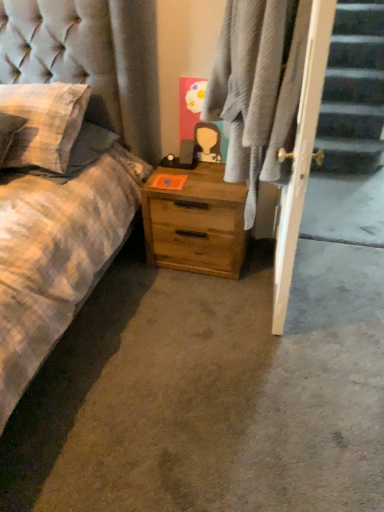
This screenshot has width=384, height=512. What do you see at coordinates (196, 222) in the screenshot?
I see `wooden nightstand at center` at bounding box center [196, 222].

What do you see at coordinates (80, 152) in the screenshot? This screenshot has height=512, width=384. I see `checkered fabric pillow at left` at bounding box center [80, 152].

In order to face checkered fabric pillow at left, should I rotate leftwards or rightwards?

Rotate your view left by about 19.138°.

Identify the location of plaid fabric at center. The width and height of the screenshot is (384, 512). (258, 88).

Where is `wooden nightstand at center`? The height and width of the screenshot is (512, 384). wooden nightstand at center is located at coordinates (196, 222).

Does checkered fabric pillow at left appear on the left side of wooden nightstand at center?

Indeed, checkered fabric pillow at left is positioned on the left side of wooden nightstand at center.

Identify the location of pillow in front of the wooden nightstand at center. (80, 152).

Looking at this image, is checkered fabric pillow at left behind wooden nightstand at center?

That is False.

Locate an element on the screen. nightstand on the left of plaid fabric at center is located at coordinates (196, 222).

Based on their positions, is wooden nightstand at center located to the left or right of plaid fabric at center?

In the image, wooden nightstand at center appears on the left side of plaid fabric at center.

How different are the orientations of wooden nightstand at center and plaid fabric at center in degrees?

There is a 83.6-degree angle between the facing directions of wooden nightstand at center and plaid fabric at center.

Can you tell me how much plaid fabric at center and checkered fabric pillow at left differ in facing direction?

74.1 degrees separate the facing orientations of plaid fabric at center and checkered fabric pillow at left.

Which is in front, point (253, 108) or point (79, 168)?

Point (253, 108)

Is plaid fabric at center in contact with checkered fabric pillow at left?

There is a gap between plaid fabric at center and checkered fabric pillow at left.

From a real-world perspective, is plaid fabric at center located beneath checkered fabric pillow at left?

No, from a real-world perspective, plaid fabric at center is not under checkered fabric pillow at left.

Considering the points (105, 137) and (230, 106), which point is behind, point (105, 137) or point (230, 106)?

The point (105, 137) is farther from the camera.

Is checkered fabric pillow at left bigger than plaid fabric at center?

Incorrect, checkered fabric pillow at left is not larger than plaid fabric at center.

How different are the orientations of checkered fabric pillow at left and plaid fabric at center in degrees?

The facing directions of checkered fabric pillow at left and plaid fabric at center are 74.1 degrees apart.

From a real-world perspective, is plaid fabric at center positioned under wooden nightstand at center based on gravity?

No, from a real-world perspective, plaid fabric at center is not beneath wooden nightstand at center.

Is plaid fabric at center not within wooden nightstand at center?

Yes.

Between plaid fabric at center and wooden nightstand at center, which one appears on the left side from the viewer's perspective?

wooden nightstand at center is more to the left.

Which is behind, point (287, 61) or point (153, 190)?

The point (153, 190) is farther from the camera.

Considering the positions of point (205, 222) and point (106, 146), is point (205, 222) closer or farther from the camera than point (106, 146)?

Point (205, 222) is closer to the camera than point (106, 146).

Could you tell me if wooden nightstand at center is facing checkered fabric pillow at left?

No, wooden nightstand at center is not facing towards checkered fabric pillow at left.

From a real-world perspective, which object rests below the other?

wooden nightstand at center, from a real-world perspective.

Between wooden nightstand at center and checkered fabric pillow at left, which one has larger width?

With larger width is checkered fabric pillow at left.

Where is `nightstand on the right of checkered fabric pillow at left`? nightstand on the right of checkered fabric pillow at left is located at coordinates (196, 222).

You are a GUI agent. You are given a task and a screenshot of the screen. Output one action in this format:
    pyautogui.click(x=<x>, y=<y>)
    Task: Click on the nightstand that is below the plaid fabric at center (from the image's perspective)
    The width and height of the screenshot is (384, 512).
    Given the screenshot: What is the action you would take?
    pyautogui.click(x=196, y=222)

Looking at the image, which one is located closer to wooden nightstand at center, checkered fabric pillow at left or plaid fabric at center?

The object closer to wooden nightstand at center is plaid fabric at center.

Which object lies further to the anchor point checkered fabric pillow at left, wooden nightstand at center or plaid fabric at center?

plaid fabric at center is further to checkered fabric pillow at left.

Estimate the real-world distances between objects in this image. Which object is closer to plaid fabric at center, wooden nightstand at center or checkered fabric pillow at left?

Based on the image, wooden nightstand at center appears to be nearer to plaid fabric at center.

Estimate the real-world distances between objects in this image. Which object is closer to checkered fabric pillow at left, plaid fabric at center or wooden nightstand at center?

Based on the image, wooden nightstand at center appears to be nearer to checkered fabric pillow at left.

Looking at the image, which one is located closer to wooden nightstand at center, plaid fabric at center or checkered fabric pillow at left?

plaid fabric at center.

From the image, which object appears to be nearer to plaid fabric at center, checkered fabric pillow at left or wooden nightstand at center?

The object closer to plaid fabric at center is wooden nightstand at center.

At what (x,y) coordinates should I click in order to perform the action: click on nightstand located between checkered fabric pillow at left and plaid fabric at center in the left-right direction. Please return your answer as a coordinate pair (x, y). Looking at the image, I should click on (196, 222).